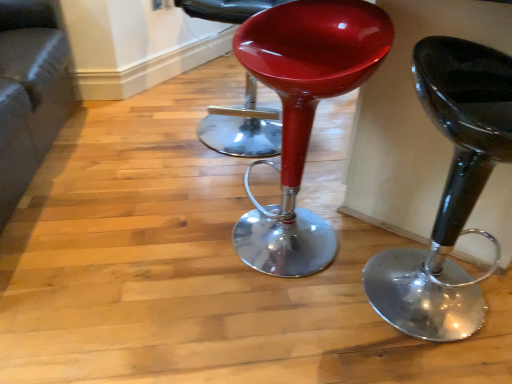
Identify the location of blank space to the left of glossy plastic stool at center, which is counted as the 1th stool, starting from the left. This screenshot has width=512, height=384. (173, 246).